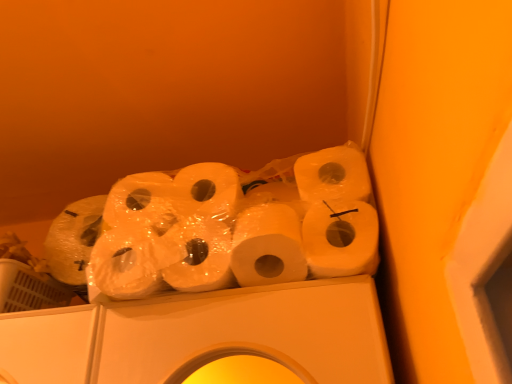
This screenshot has width=512, height=384. Describe the element at coordinates (236, 227) in the screenshot. I see `white matte toilet paper at center` at that location.

Identify the location of white matte toilet paper at center. (236, 227).

The width and height of the screenshot is (512, 384). What are the coordinates of `white matte toilet paper at center` in the screenshot? It's located at [x=236, y=227].